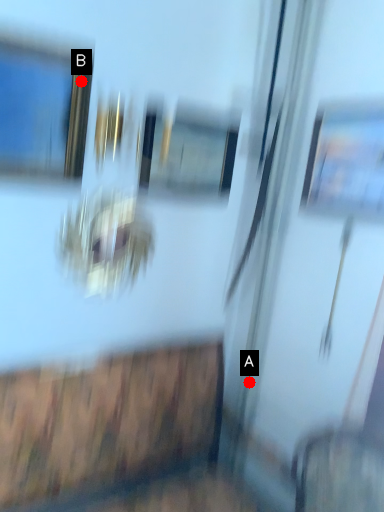
Question: Two points are circled on the image, labeled by A and B beside each circle. Which point is closer to the camera?

Choices:
 (A) A is closer
 (B) B is closer

Answer: (B)